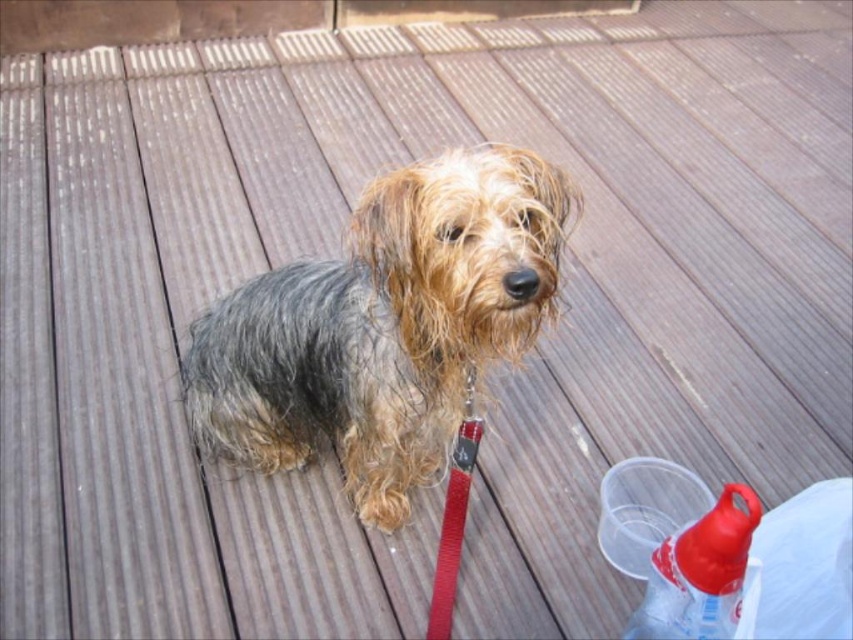
Question: Is fuzzy fur dog at center below red nylon leash at center?

Choices:
 (A) no
 (B) yes

Answer: (A)

Question: Can you confirm if fuzzy fur dog at center is bigger than translucent plastic bottle at lower right?

Choices:
 (A) yes
 (B) no

Answer: (A)

Question: Among these points, which one is farthest from the camera?

Choices:
 (A) (450, 602)
 (B) (436, 170)
 (C) (642, 611)

Answer: (C)

Question: Which object appears farthest from the camera in this image?

Choices:
 (A) red nylon leash at center
 (B) fuzzy fur dog at center
 (C) translucent plastic bottle at lower right

Answer: (A)

Question: Can you confirm if translucent plastic bottle at lower right is smaller than red nylon leash at center?

Choices:
 (A) no
 (B) yes

Answer: (A)

Question: Among these objects, which one is nearest to the camera?

Choices:
 (A) translucent plastic bottle at lower right
 (B) red nylon leash at center
 (C) fuzzy fur dog at center

Answer: (C)